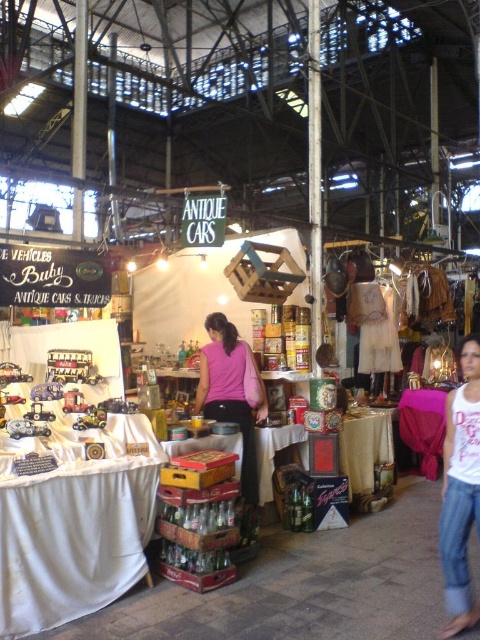
You are a customer in the market and want to buy a pink clothing item. You see the pink cotton tank top at lower right and the pink matte shirt at center. Which one takes up less space when stored?

The pink cotton tank top at lower right occupies less space than the pink matte shirt at center, so it would be better for storage.

You are a customer in the market holding a measuring tape. You see the pink cotton tank top at lower right and the pink matte shirt at center. How far apart are these two items?

The distance between the pink cotton tank top at lower right and the pink matte shirt at center is 2.43 meters.

You are a customer in the market and want to buy a pink top. You see both the pink cotton tank top at lower right and the pink matte shirt at center. Which one is taller?

The pink cotton tank top at lower right is taller than the pink matte shirt at center.